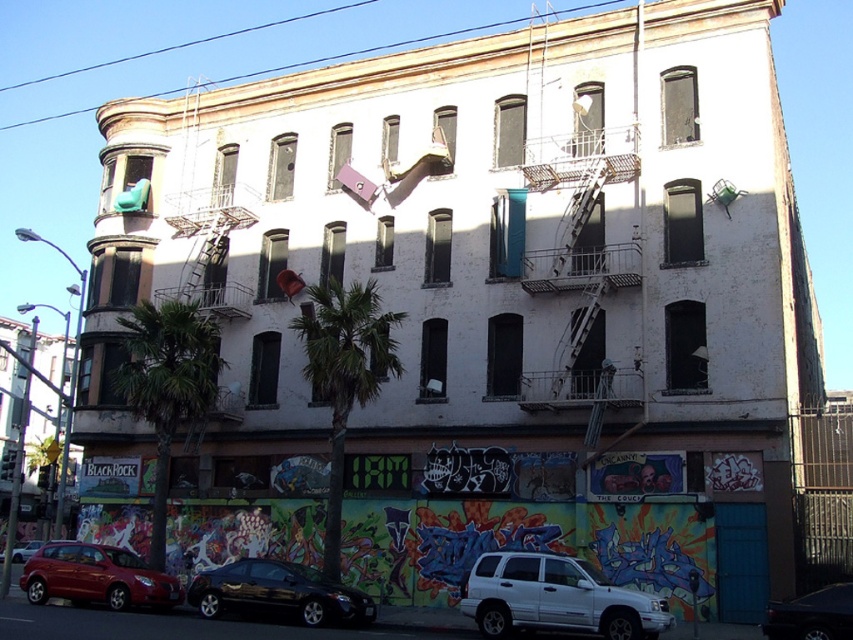
You are standing at the entrance of the multi story building with rounded corners and weathered facade. You see a matte red suv at lower left. Can you tell me what is located at the point (96, 577)?

The point (96, 577) corresponds to the location of the matte red suv at lower left.

You are a delivery person standing at the entrance of the building. You need to park your matte red suv at lower left in a spot that is exactly 33.62 meters away from the entrance. Is this parking spot available?

The matte red suv at lower left is 33.62 meters away from the entrance, so the parking spot at that distance is available for the delivery person to use.

You are standing at the entrance of the building and see a point marked at coordinates (x=96, y=577). What object is located at that point?

The point at coordinates (x=96, y=577) is occupied by a matte red suv at lower left.